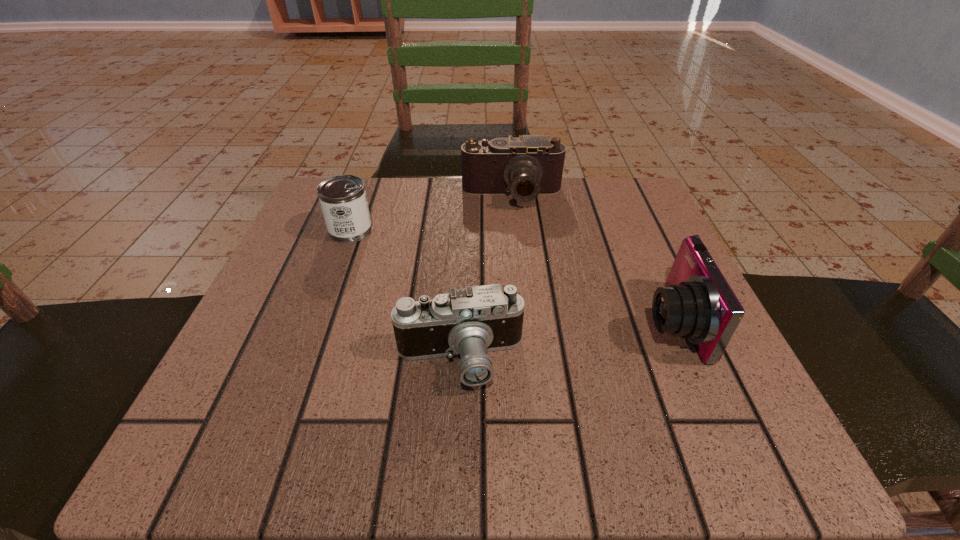
The width and height of the screenshot is (960, 540). I want to click on the farthest object, so click(x=526, y=166).

Locate an element on the screen. the rightmost camera is located at coordinates (698, 304).

Identify the location of the third nearest object. This screenshot has height=540, width=960. (343, 200).

Locate an element on the screen. This screenshot has height=540, width=960. can is located at coordinates (343, 200).

Locate an element on the screen. This screenshot has width=960, height=540. free region located 0.050m on the front-facing side of the farthest object is located at coordinates (516, 225).

The image size is (960, 540). Find the location of `vacant space situated on the front-facing side of the rightmost object`. vacant space situated on the front-facing side of the rightmost object is located at coordinates (444, 321).

The width and height of the screenshot is (960, 540). Find the location of `free space located on the front-facing side of the rightmost object`. free space located on the front-facing side of the rightmost object is located at coordinates (464, 321).

The image size is (960, 540). I want to click on vacant space located on the front-facing side of the rightmost object, so click(x=557, y=321).

Locate an element on the screen. This screenshot has width=960, height=540. vacant space situated on the front of the leftmost object is located at coordinates (321, 310).

Image resolution: width=960 pixels, height=540 pixels. In order to click on camera present at the far edge in this screenshot , I will do `click(526, 166)`.